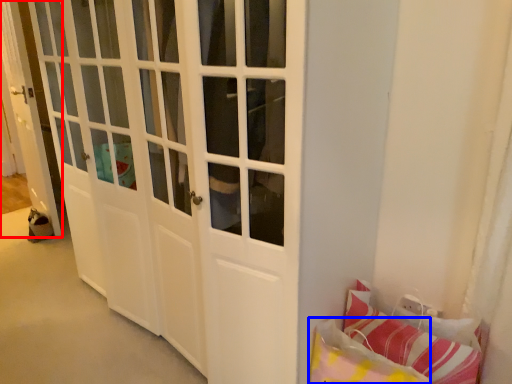
Question: Among these objects, which one is nearest to the camera, door (highlighted by a red box) or pillow (highlighted by a blue box)?

Choices:
 (A) door
 (B) pillow

Answer: (B)